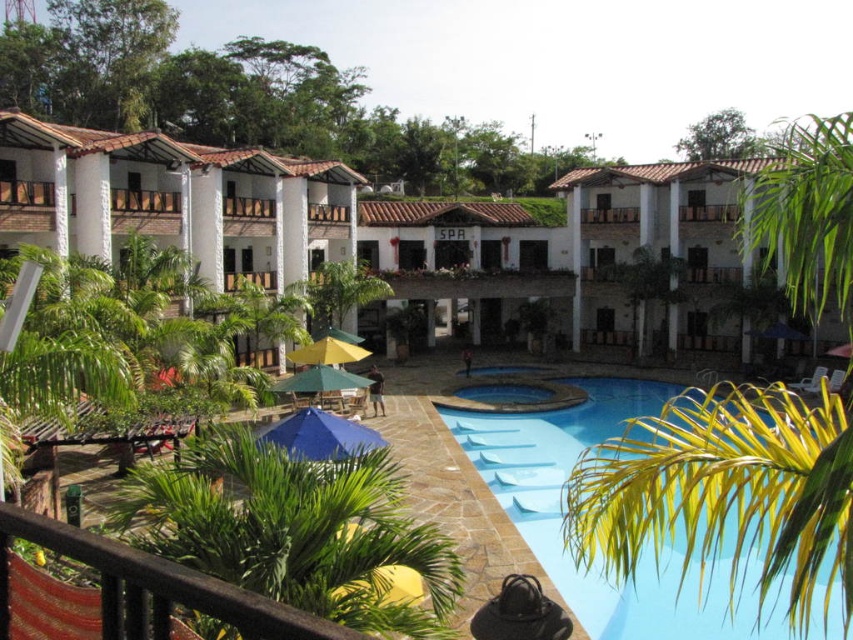
You are standing at the edge of the pool and want to take a photo of the white stucco building at upper left. If your camera has a maximum zoom range of 20 meters, will you be able to capture the building clearly without moving closer?

The white stucco building at upper left is 24.23 meters away from the camera. Since the camera can only zoom up to 20 meters, you won